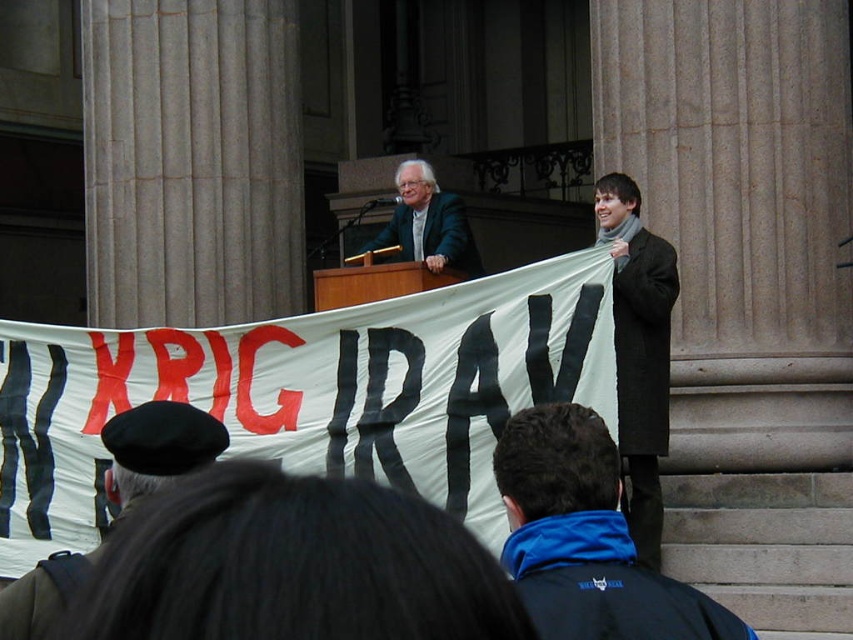
Between blue fleece jacket at lower center and matte black suit at center, which one has more height?

With more height is matte black suit at center.

Is blue fleece jacket at lower center further to camera compared to matte black suit at center?

No, blue fleece jacket at lower center is closer to the viewer.

Does point (573, 579) lie behind point (479, 268)?

No, (573, 579) is closer to viewer.

The image size is (853, 640). Identify the location of blue fleece jacket at lower center. (585, 538).

Is blue fleece jacket at lower center shorter than dark gray wool coat at right?

Incorrect, blue fleece jacket at lower center's height does not fall short of dark gray wool coat at right's.

Which is in front, point (614, 456) or point (631, 214)?

Positioned in front is point (614, 456).

The width and height of the screenshot is (853, 640). I want to click on blue fleece jacket at lower center, so click(x=585, y=538).

Is black beret at center above matte black suit at center?

No, black beret at center is not above matte black suit at center.

Measure the distance from black beret at center to matte black suit at center.

11.29 meters

Identify the location of black beret at center. The image size is (853, 640). (157, 445).

Locate an element on the screen. The image size is (853, 640). black beret at center is located at coordinates (157, 445).